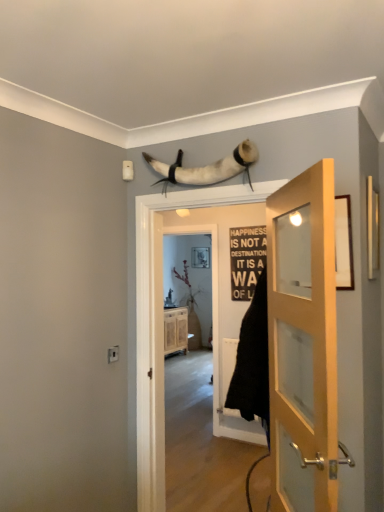
Question: From a real-world perspective, does matte black picture frame at upper center stand above wooden cabinet at center?

Choices:
 (A) yes
 (B) no

Answer: (A)

Question: Does matte black picture frame at upper center have a greater width compared to wooden cabinet at center?

Choices:
 (A) no
 (B) yes

Answer: (A)

Question: Is matte black picture frame at upper center next to wooden cabinet at center and touching it?

Choices:
 (A) no
 (B) yes

Answer: (A)

Question: Is wooden cabinet at center located within matte black picture frame at upper center?

Choices:
 (A) no
 (B) yes

Answer: (A)

Question: Does matte black picture frame at upper center have a larger size compared to wooden cabinet at center?

Choices:
 (A) yes
 (B) no

Answer: (B)

Question: Does matte black picture frame at upper center appear on the left side of wooden cabinet at center?

Choices:
 (A) no
 (B) yes

Answer: (A)

Question: Is white leather horns at upper center taller than white wooden door at center, which is the second door in front-to-back order?

Choices:
 (A) no
 (B) yes

Answer: (A)

Question: Considering the relative sizes of white leather horns at upper center and white wooden door at center, the 2th door when ordered from right to left, in the image provided, is white leather horns at upper center wider than white wooden door at center, the 2th door when ordered from right to left,?

Choices:
 (A) no
 (B) yes

Answer: (A)

Question: Is white leather horns at upper center positioned beyond the bounds of white wooden door at center, which appears as the 1th door when viewed from the back?

Choices:
 (A) yes
 (B) no

Answer: (A)

Question: Does white leather horns at upper center have a lesser width compared to white wooden door at center, which appears as the 1th door when viewed from the back?

Choices:
 (A) yes
 (B) no

Answer: (A)

Question: Is white leather horns at upper center bigger than white wooden door at center, arranged as the first door when viewed from the left?

Choices:
 (A) yes
 (B) no

Answer: (B)

Question: Is white wooden door at center, which is the second door in front-to-back order, at the back of white leather horns at upper center?

Choices:
 (A) no
 (B) yes

Answer: (A)

Question: From a real-world perspective, does wooden cabinet at center sit lower than white leather horns at upper center?

Choices:
 (A) no
 (B) yes

Answer: (B)